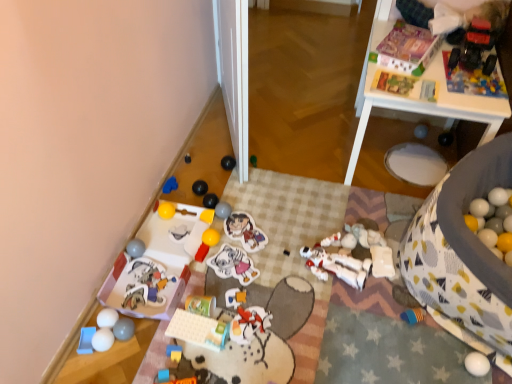
Locate an element on the screen. free space behind rubber ball at center, the tenth toy when ordered from right to left is located at coordinates tap(236, 194).